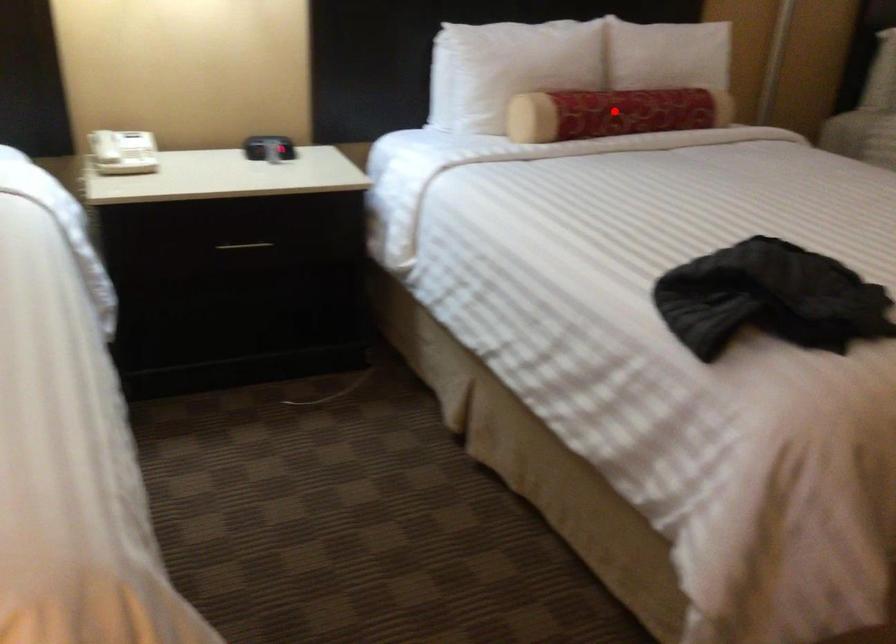
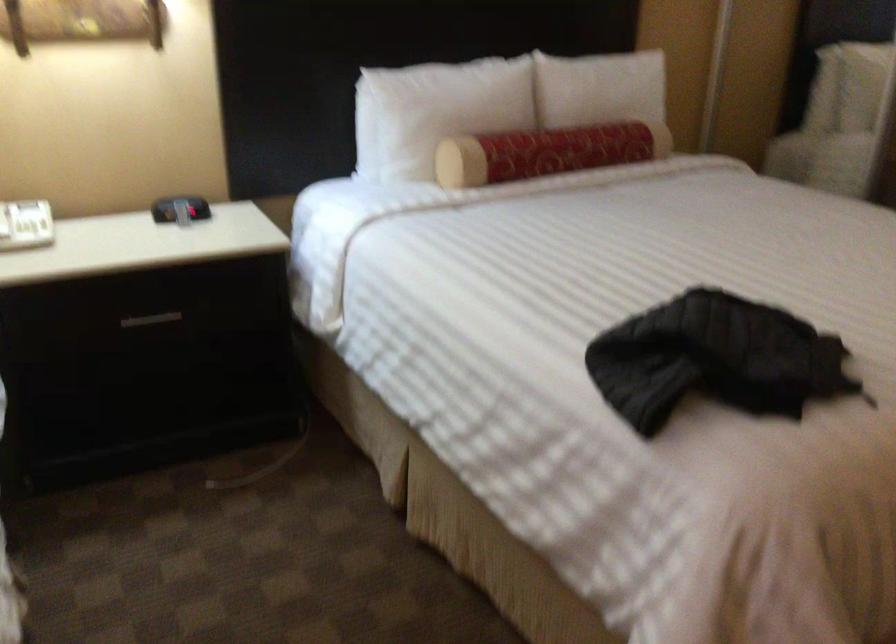
Locate, in the second image, the point that corresponds to the highlighted location in the first image.

(546, 152)